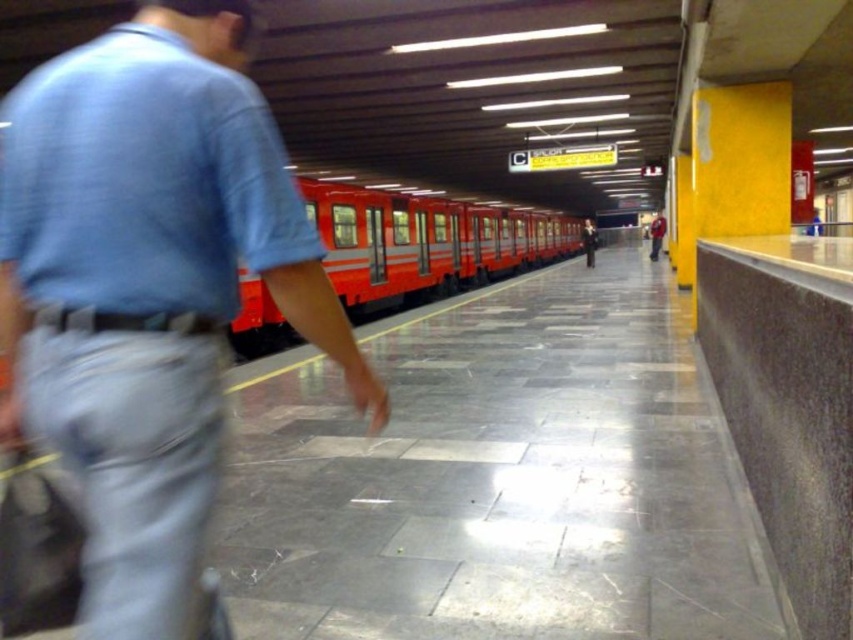
Is point (236, 19) positioned in front of point (480, 282)?

Yes, point (236, 19) is in front of point (480, 282).

Can you confirm if denim jeans at left is shorter than shiny red train at center?

Yes.

Find the location of a particular element. This screenshot has height=640, width=853. denim jeans at left is located at coordinates (148, 288).